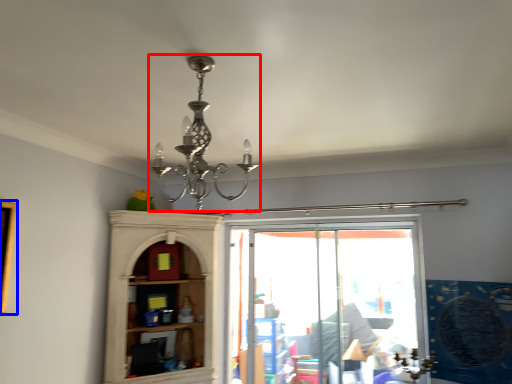
Question: Which of the following is the closest to the observer, lamp (highlighted by a red box) or picture frame (highlighted by a blue box)?

Choices:
 (A) lamp
 (B) picture frame

Answer: (A)